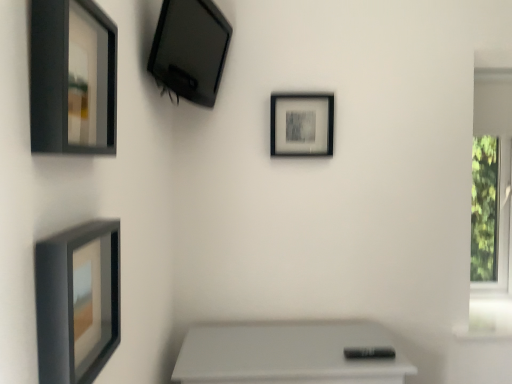
Question: Does matte black picture frame at lower left, positioned as the third picture frame in back-to-front order, come behind matte black tv at upper left, placed as the 2th picture frame when sorted from right to left?

Choices:
 (A) no
 (B) yes

Answer: (A)

Question: From the image's perspective, is matte black picture frame at lower left, arranged as the 4th picture frame when viewed from the top, beneath matte black tv at upper left, the 3th picture frame positioned from the left?

Choices:
 (A) no
 (B) yes

Answer: (B)

Question: Considering the relative sizes of matte black picture frame at lower left, arranged as the 4th picture frame when viewed from the top, and matte black tv at upper left, acting as the 2th picture frame starting from the back, in the image provided, is matte black picture frame at lower left, arranged as the 4th picture frame when viewed from the top, smaller than matte black tv at upper left, acting as the 2th picture frame starting from the back,?

Choices:
 (A) no
 (B) yes

Answer: (B)

Question: From a real-world perspective, is matte black picture frame at lower left, which appears as the 2th picture frame when viewed from the left, under matte black tv at upper left, acting as the 2th picture frame starting from the back?

Choices:
 (A) no
 (B) yes

Answer: (B)

Question: Is matte black picture frame at lower left, which appears as the 2th picture frame when viewed from the left, next to matte black tv at upper left, positioned as the 3th picture frame in front-to-back order, and touching it?

Choices:
 (A) yes
 (B) no

Answer: (B)

Question: In terms of height, does matte black picture frame at lower left, positioned as the third picture frame in back-to-front order, look taller or shorter compared to matte black picture frame at upper left, the fourth picture frame in the back-to-front sequence?

Choices:
 (A) short
 (B) tall

Answer: (A)

Question: In terms of width, does matte black picture frame at lower left, the 3th picture frame in the right-to-left sequence, look wider or thinner when compared to matte black picture frame at upper left, the fourth picture frame in the back-to-front sequence?

Choices:
 (A) wide
 (B) thin

Answer: (A)

Question: In terms of size, does matte black picture frame at lower left, placed as the first picture frame when sorted from bottom to top, appear bigger or smaller than matte black picture frame at upper left, arranged as the 2th picture frame when ordered from the bottom?

Choices:
 (A) big
 (B) small

Answer: (A)

Question: Would you say matte black picture frame at lower left, positioned as the third picture frame in back-to-front order, is inside or outside matte black picture frame at upper left, which appears as the 4th picture frame when viewed from the right?

Choices:
 (A) inside
 (B) outside

Answer: (B)

Question: Do you think matte black picture frame at upper left, placed as the first picture frame when sorted from left to right, is within white plastic window frame at right, or outside of it?

Choices:
 (A) outside
 (B) inside

Answer: (A)

Question: Considering their positions, is matte black picture frame at upper left, placed as the first picture frame when sorted from left to right, located in front of or behind white plastic window frame at right?

Choices:
 (A) behind
 (B) front

Answer: (B)

Question: Based on their sizes in the image, would you say matte black picture frame at upper left, the fourth picture frame in the back-to-front sequence, is bigger or smaller than white plastic window frame at right?

Choices:
 (A) small
 (B) big

Answer: (A)

Question: In terms of width, does matte black picture frame at upper left, the 1th picture frame from the front, look wider or thinner when compared to white plastic window frame at right?

Choices:
 (A) wide
 (B) thin

Answer: (B)

Question: Is point (70, 36) closer or farther from the camera than point (286, 127)?

Choices:
 (A) closer
 (B) farther

Answer: (A)

Question: From their relative heights in the image, would you say matte black picture frame at upper left, which appears as the 4th picture frame when viewed from the right, is taller or shorter than matte black picture frame at center, placed as the second picture frame when sorted from top to bottom?

Choices:
 (A) short
 (B) tall

Answer: (B)